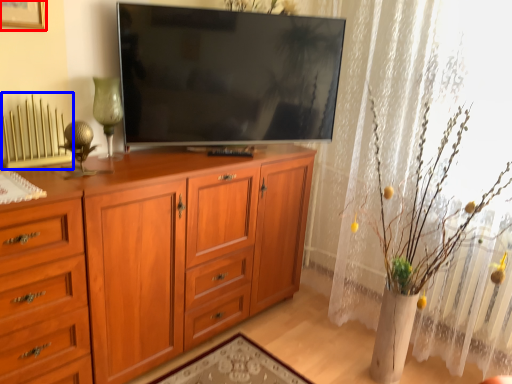
Question: Which of the following is the farthest to the observer, picture frame (highlighted by a red box) or radiator (highlighted by a blue box)?

Choices:
 (A) picture frame
 (B) radiator

Answer: (B)